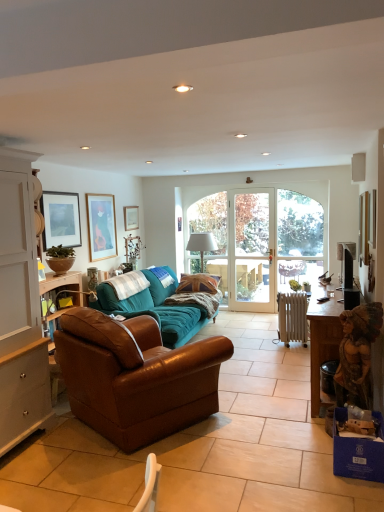
Question: Is matte wooden picture frame at upper center, arranged as the fourth picture frame when viewed from the front, at the right side of clear glass door at center?

Choices:
 (A) yes
 (B) no

Answer: (B)

Question: Would you say matte wooden picture frame at upper center, the second picture frame positioned from the right, is outside clear glass door at center?

Choices:
 (A) yes
 (B) no

Answer: (A)

Question: Can you confirm if matte wooden picture frame at upper center, arranged as the fourth picture frame when viewed from the front, is bigger than clear glass door at center?

Choices:
 (A) yes
 (B) no

Answer: (B)

Question: From a real-world perspective, does matte wooden picture frame at upper center, which ranks as the first picture frame in back-to-front order, sit lower than clear glass door at center?

Choices:
 (A) no
 (B) yes

Answer: (A)

Question: Is clear glass door at center inside matte wooden picture frame at upper center, the second picture frame positioned from the right?

Choices:
 (A) yes
 (B) no

Answer: (B)

Question: From the image's perspective, is clear glass door at center positioned above or below teal fabric couch at center, the 2th studio couch positioned from the front?

Choices:
 (A) above
 (B) below

Answer: (A)

Question: Considering the positions of clear glass door at center and teal fabric couch at center, the 2th studio couch positioned from the front, in the image, is clear glass door at center bigger or smaller than teal fabric couch at center, the 2th studio couch positioned from the front,?

Choices:
 (A) small
 (B) big

Answer: (A)

Question: From their relative heights in the image, would you say clear glass door at center is taller or shorter than teal fabric couch at center, the 2th studio couch positioned from the front?

Choices:
 (A) tall
 (B) short

Answer: (A)

Question: Is clear glass door at center inside the boundaries of teal fabric couch at center, which is counted as the first studio couch, starting from the back, or outside?

Choices:
 (A) outside
 (B) inside

Answer: (A)

Question: Is clear glass door at center in front of or behind matte wooden picture frame at upper center, which ranks as the first picture frame in back-to-front order, in the image?

Choices:
 (A) front
 (B) behind

Answer: (B)

Question: In terms of size, does clear glass door at center appear bigger or smaller than matte wooden picture frame at upper center, which ranks as the first picture frame in back-to-front order?

Choices:
 (A) big
 (B) small

Answer: (A)

Question: Looking at their shapes, would you say clear glass door at center is wider or thinner than matte wooden picture frame at upper center, which ranks as the first picture frame in back-to-front order?

Choices:
 (A) thin
 (B) wide

Answer: (B)

Question: From their relative heights in the image, would you say clear glass door at center is taller or shorter than matte wooden picture frame at upper center, the second picture frame positioned from the right?

Choices:
 (A) short
 (B) tall

Answer: (B)

Question: Is white wood cabinet at left taller or shorter than teal fabric couch at center, the 2th studio couch positioned from the front?

Choices:
 (A) short
 (B) tall

Answer: (B)

Question: Is point (46, 353) positioned closer to the camera than point (152, 293)?

Choices:
 (A) closer
 (B) farther

Answer: (A)